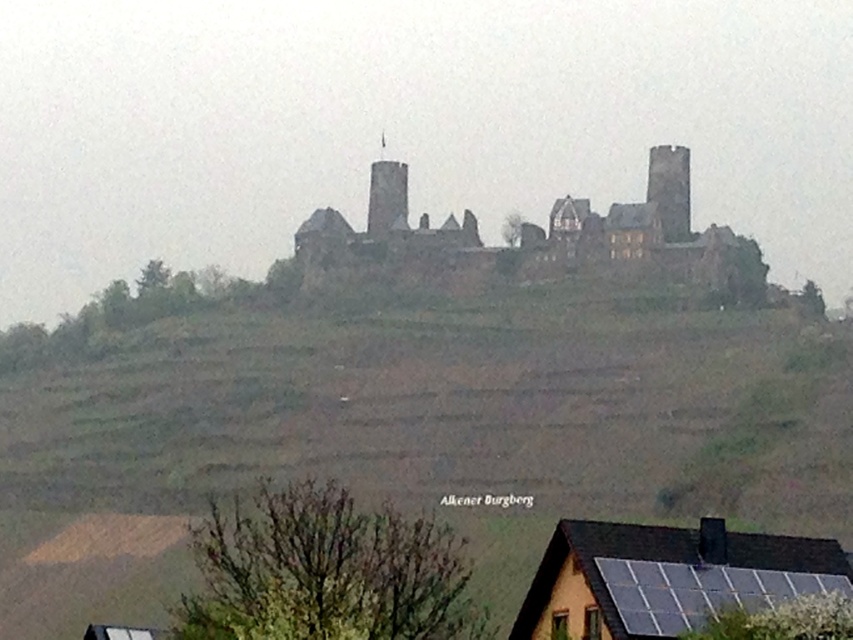
Is brown stone castle at center to the left of black solar panels at lower right from the viewer's perspective?

Yes, brown stone castle at center is to the left of black solar panels at lower right.

Between brown stone castle at center and black solar panels at lower right, which one appears on the right side from the viewer's perspective?

Positioned to the right is black solar panels at lower right.

This screenshot has width=853, height=640. What do you see at coordinates (531, 243) in the screenshot?
I see `brown stone castle at center` at bounding box center [531, 243].

At what (x,y) coordinates should I click in order to perform the action: click on brown stone castle at center. Please return your answer as a coordinate pair (x, y). Image resolution: width=853 pixels, height=640 pixels. Looking at the image, I should click on (531, 243).

Is point (692, 502) positioned after point (381, 248)?

No, it is not.

Can you confirm if green grassy hillside at upper center is shorter than brown stone castle at center?

No.

Does point (386, 387) come in front of point (415, 291)?

Yes.

Locate an element on the screen. The height and width of the screenshot is (640, 853). green grassy hillside at upper center is located at coordinates (416, 432).

Which is in front, point (10, 372) or point (556, 580)?

Point (556, 580)

Is point (601, 388) in front of point (641, 586)?

That is False.

Which is in front, point (85, 353) or point (544, 579)?

Point (544, 579) is more forward.

The height and width of the screenshot is (640, 853). I want to click on green grassy hillside at upper center, so click(416, 432).